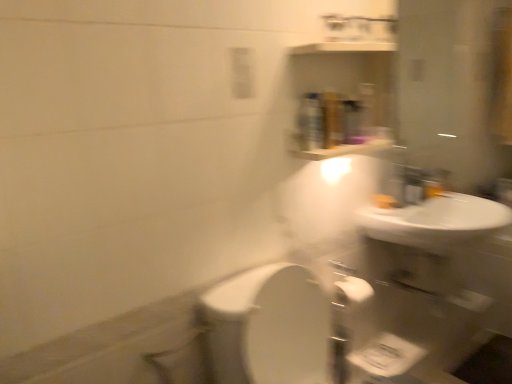
Question: Is matte silver faucet at upper right bigger than white glossy sink at upper right?

Choices:
 (A) no
 (B) yes

Answer: (A)

Question: From a real-world perspective, is matte silver faucet at upper right located beneath white glossy sink at upper right?

Choices:
 (A) yes
 (B) no

Answer: (B)

Question: Is matte silver faucet at upper right behind white glossy sink at upper right?

Choices:
 (A) yes
 (B) no

Answer: (A)

Question: Is matte silver faucet at upper right oriented towards white glossy sink at upper right?

Choices:
 (A) no
 (B) yes

Answer: (A)

Question: Is matte silver faucet at upper right located outside white glossy sink at upper right?

Choices:
 (A) yes
 (B) no

Answer: (A)

Question: Is matte silver faucet at upper right directly adjacent to white glossy sink at upper right?

Choices:
 (A) no
 (B) yes

Answer: (A)

Question: Is white glossy sink at upper right at the right side of matte silver faucet at upper right?

Choices:
 (A) no
 (B) yes

Answer: (B)

Question: Considering the relative sizes of white glossy sink at upper right and matte silver faucet at upper right in the image provided, is white glossy sink at upper right shorter than matte silver faucet at upper right?

Choices:
 (A) yes
 (B) no

Answer: (B)

Question: Is white glossy sink at upper right positioned behind matte silver faucet at upper right?

Choices:
 (A) no
 (B) yes

Answer: (A)

Question: From the image's perspective, is white glossy sink at upper right below matte silver faucet at upper right?

Choices:
 (A) yes
 (B) no

Answer: (A)

Question: Can you confirm if white glossy sink at upper right is thinner than matte silver faucet at upper right?

Choices:
 (A) yes
 (B) no

Answer: (B)

Question: Can you confirm if white glossy sink at upper right is wider than matte silver faucet at upper right?

Choices:
 (A) yes
 (B) no

Answer: (A)

Question: Considering their positions, is white glossy sink at upper right located in front of or behind matte silver faucet at upper right?

Choices:
 (A) behind
 (B) front

Answer: (B)